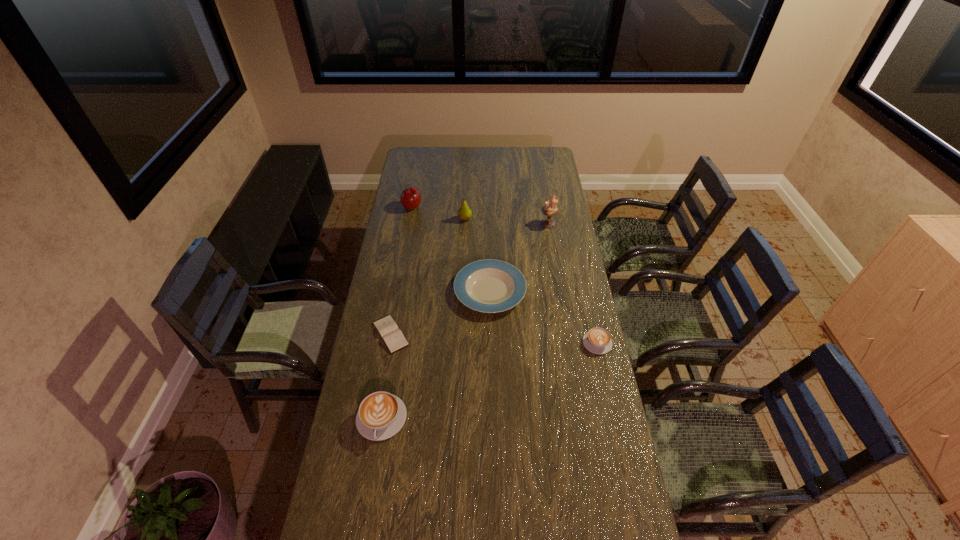
This screenshot has width=960, height=540. Identify the location of apple located in the left edge section of the desktop. (410, 198).

Find the location of `diary that is at the left edge`. diary that is at the left edge is located at coordinates (392, 336).

I want to click on cappuccino present at the right edge, so click(x=597, y=340).

The height and width of the screenshot is (540, 960). Find the location of `candle holder located at the right edge`. candle holder located at the right edge is located at coordinates (549, 210).

Locate an element on the screen. vacant space at the far edge of the desktop is located at coordinates [467, 156].

Image resolution: width=960 pixels, height=540 pixels. I want to click on vacant space at the left edge of the desktop, so click(x=365, y=395).

In the image, there is a desktop. Identify the location of free space at the right edge. (553, 274).

The image size is (960, 540). In order to click on vacant space at the far left corner in this screenshot , I will do `click(406, 156)`.

In order to click on vacant space at the near left corner in this screenshot , I will do `click(326, 516)`.

Locate an element on the screen. This screenshot has height=540, width=960. free point at the far right corner is located at coordinates (542, 167).